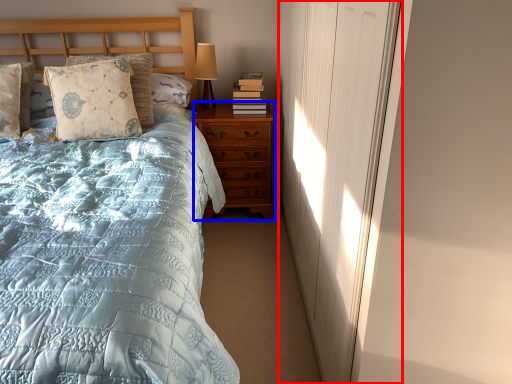
Question: Which of the following is the closest to the observer, curtain (highlighted by a red box) or nightstand (highlighted by a blue box)?

Choices:
 (A) curtain
 (B) nightstand

Answer: (A)